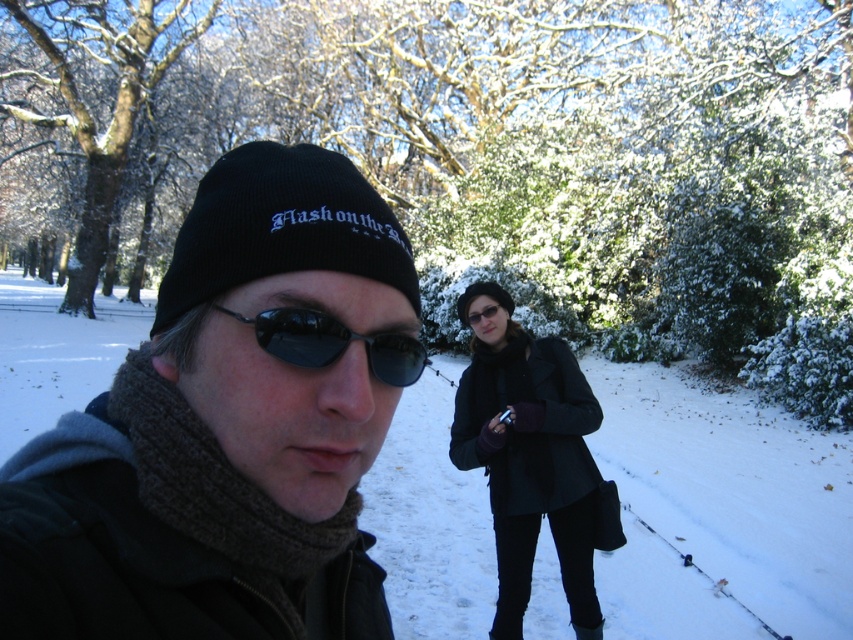
Image resolution: width=853 pixels, height=640 pixels. Identify the location of black matte coat at center. (527, 454).

Is point (486, 344) closer to camera compared to point (289, 339)?

That is False.

What do you see at coordinates (527, 454) in the screenshot? The height and width of the screenshot is (640, 853). I see `black matte coat at center` at bounding box center [527, 454].

This screenshot has width=853, height=640. In order to click on black matte coat at center in this screenshot , I will do (x=527, y=454).

Does black knit cap at center have a larger size compared to black reflective sunglasses at center?

Yes.

Is black knit cap at center positioned at the back of black reflective sunglasses at center?

No, it is in front of black reflective sunglasses at center.

Does point (48, 461) lie in front of point (398, 339)?

No, it is behind (398, 339).

The height and width of the screenshot is (640, 853). Identify the location of black knit cap at center. (229, 426).

You are a GUI agent. You are given a task and a screenshot of the screen. Output one action in this format:
    pyautogui.click(x=<x>, y=<y>)
    Task: Click on the black knit cap at center
    This screenshot has height=640, width=853.
    Given the screenshot: What is the action you would take?
    pyautogui.click(x=229, y=426)

Is black knit cap at center smaller than black matte coat at center?

Yes, black knit cap at center is smaller than black matte coat at center.

Is point (364, 628) farther from viewer compared to point (498, 502)?

No, it is not.

Where is `black knit cap at center`? The height and width of the screenshot is (640, 853). black knit cap at center is located at coordinates (229, 426).